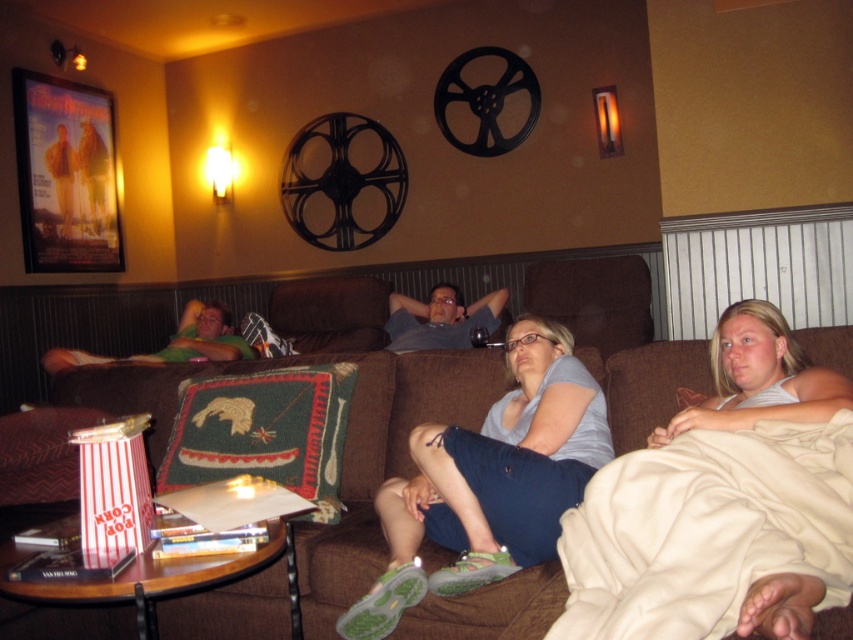
You are a guest in this living room and want to sit on the green fabric couch at left. The matte gray shirt at center is currently on the couch. Can you sit there without moving the shirt?

The matte gray shirt at center is smaller than the green fabric couch at left, so there should be enough space to sit on the couch without moving the shirt.

You are standing in the room and want to place a small decorative item exactly at the point marked as point (610, 468). If your arm reaches out 1.2 meters, can you comfortably place the item without moving closer?

The distance of point (610, 468) from viewer is 1.37 meters, so your arm reaches 1.2 meters, which is shorter than the required distance. You need to move closer to reach it.

You are a delivery person who needs to place a small package between the beige fleece blanket at lower right and the matte gray shirt at center. Can you fit the package in that space if the package is 10 feet long?

The distance between the beige fleece blanket at lower right and the matte gray shirt at center is 8.26 feet, so the 10 feet long package cannot fit in that space.